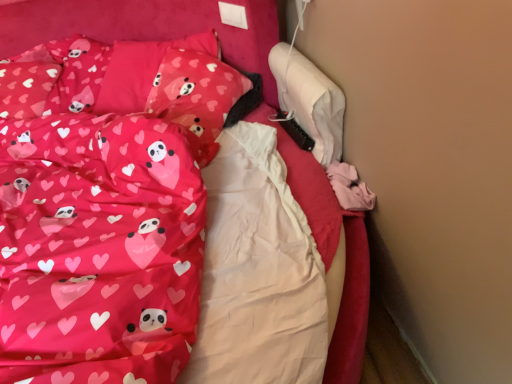
Question: Could you tell me if matte pink pillow at upper left, marked as the second pillow in a front-to-back arrangement, is turned towards matte pink fabric at left?

Choices:
 (A) no
 (B) yes

Answer: (B)

Question: From a real-world perspective, is matte pink pillow at upper left, marked as the second pillow in a front-to-back arrangement, on matte pink fabric at left?

Choices:
 (A) no
 (B) yes

Answer: (A)

Question: Is the position of matte pink pillow at upper left, the 1th pillow in the back-to-front sequence, more distant than that of matte pink fabric at left?

Choices:
 (A) yes
 (B) no

Answer: (A)

Question: Can you confirm if matte pink pillow at upper left, marked as the second pillow in a front-to-back arrangement, is wider than matte pink fabric at left?

Choices:
 (A) no
 (B) yes

Answer: (A)

Question: Is matte pink pillow at upper left, marked as the second pillow in a front-to-back arrangement, next to matte pink fabric at left?

Choices:
 (A) yes
 (B) no

Answer: (B)

Question: Would you say matte pink fabric bed at center is to the left or to the right of matte pink pillow at upper left, marked as the second pillow in a front-to-back arrangement, in the picture?

Choices:
 (A) left
 (B) right

Answer: (A)

Question: Looking at the image, does matte pink fabric bed at center seem bigger or smaller compared to matte pink pillow at upper left, the 1th pillow in the back-to-front sequence?

Choices:
 (A) small
 (B) big

Answer: (B)

Question: Choose the correct answer: Is matte pink fabric bed at center inside matte pink pillow at upper left, marked as the second pillow in a front-to-back arrangement, or outside it?

Choices:
 (A) outside
 (B) inside

Answer: (A)

Question: From a real-world perspective, relative to matte pink pillow at upper left, the 1th pillow in the back-to-front sequence, is matte pink fabric bed at center vertically above or below?

Choices:
 (A) above
 (B) below

Answer: (B)

Question: Considering the positions of matte pink pillow at upper left, the 1th pillow in the back-to-front sequence, and matte pink pillow with heart and panda design at upper left, arranged as the second pillow when viewed from the back, in the image, is matte pink pillow at upper left, the 1th pillow in the back-to-front sequence, wider or thinner than matte pink pillow with heart and panda design at upper left, arranged as the second pillow when viewed from the back,?

Choices:
 (A) wide
 (B) thin

Answer: (A)

Question: From a real-world perspective, is matte pink pillow at upper left, marked as the second pillow in a front-to-back arrangement, above or below matte pink pillow with heart and panda design at upper left, which is the first pillow in front-to-back order?

Choices:
 (A) below
 (B) above

Answer: (B)

Question: In the image, is matte pink pillow at upper left, marked as the second pillow in a front-to-back arrangement, positioned in front of or behind matte pink pillow with heart and panda design at upper left, which is the first pillow in front-to-back order?

Choices:
 (A) behind
 (B) front

Answer: (A)

Question: Is matte pink pillow at upper left, the 1th pillow in the back-to-front sequence, bigger or smaller than matte pink pillow with heart and panda design at upper left, which is the first pillow in front-to-back order?

Choices:
 (A) small
 (B) big

Answer: (B)

Question: Relative to matte pink fabric bed at center, is matte pink pillow with heart and panda design at upper left, which is the first pillow in front-to-back order, in front or behind?

Choices:
 (A) front
 (B) behind

Answer: (B)

Question: From the image's perspective, relative to matte pink fabric bed at center, is matte pink pillow with heart and panda design at upper left, which is the first pillow in front-to-back order, above or below?

Choices:
 (A) above
 (B) below

Answer: (A)